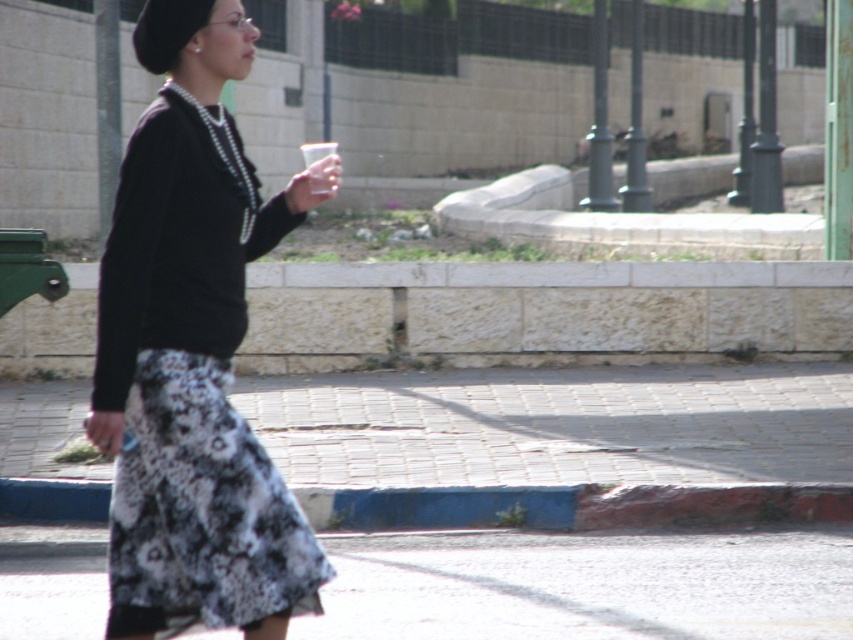
Does white textured pavement at lower center appear on the right side of pearl necklace at upper center?

Correct, you'll find white textured pavement at lower center to the right of pearl necklace at upper center.

Can you confirm if white textured pavement at lower center is smaller than pearl necklace at upper center?

Actually, white textured pavement at lower center might be larger than pearl necklace at upper center.

Is point (639, 580) positioned in front of point (171, 92)?

That is False.

Image resolution: width=853 pixels, height=640 pixels. What are the coordinates of `white textured pavement at lower center` in the screenshot? It's located at (585, 586).

Is black matte sweater at center bigger than pearl necklace at upper center?

Yes, black matte sweater at center is bigger than pearl necklace at upper center.

The width and height of the screenshot is (853, 640). What do you see at coordinates (193, 352) in the screenshot? I see `black matte sweater at center` at bounding box center [193, 352].

Locate an element on the screen. black matte sweater at center is located at coordinates (193, 352).

Can you confirm if black matte sweater at center is wider than white textured pavement at lower center?

No, black matte sweater at center is not wider than white textured pavement at lower center.

Who is more forward, (177, 154) or (782, 532)?

Point (177, 154)

Is point (164, 225) positioned in front of point (791, 634)?

Yes.

At what (x,y) coordinates should I click in order to perform the action: click on black matte sweater at center. Please return your answer as a coordinate pair (x, y). The image size is (853, 640). Looking at the image, I should click on (193, 352).